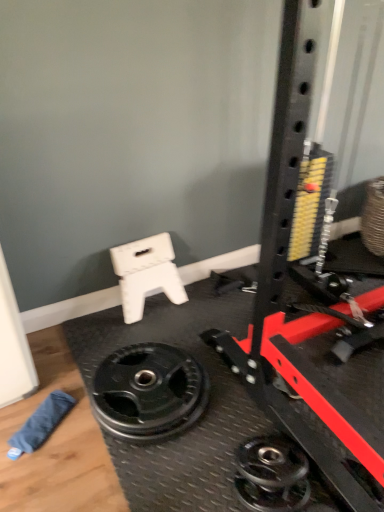
What do you see at coordinates (149, 392) in the screenshot? I see `black rubber weight plate at lower center` at bounding box center [149, 392].

At what (x,y) coordinates should I click in order to perform the action: click on black rubber weight plate at lower center. Please return your answer as a coordinate pair (x, y). Looking at the image, I should click on (149, 392).

Identify the location of black rubber weight plate at lower center. Image resolution: width=384 pixels, height=512 pixels. (149, 392).